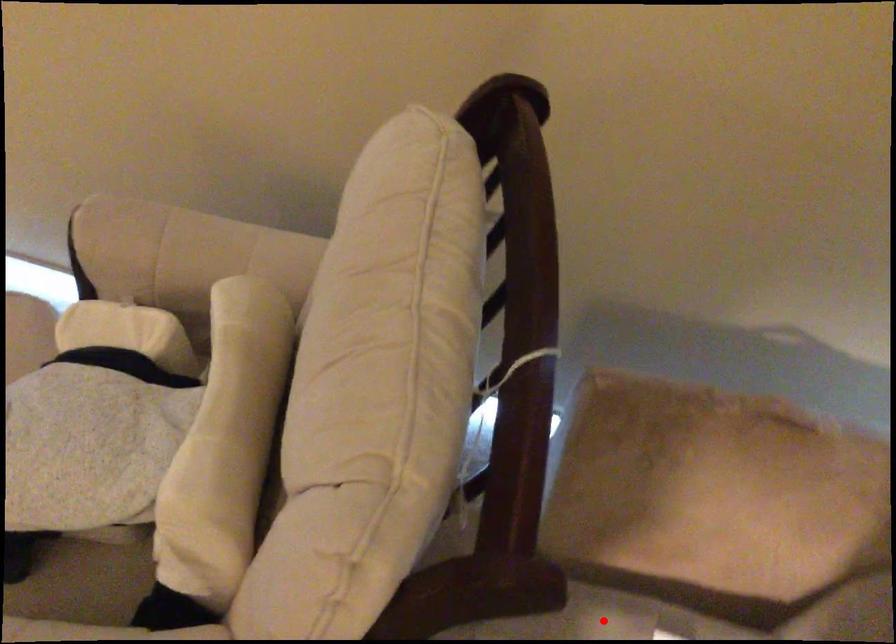
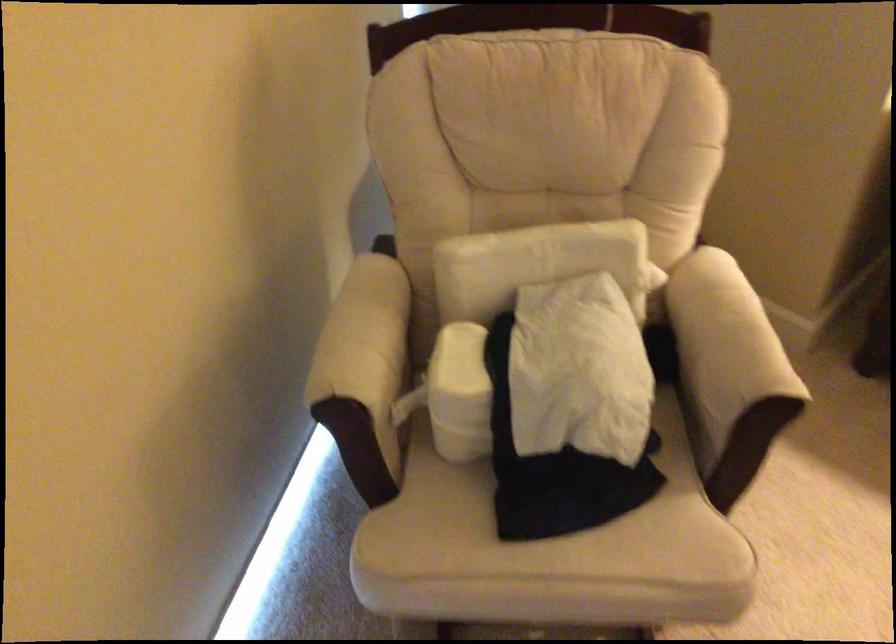
Question: I am providing you with two images of the same scene from different viewpoints. A red point is marked on the first image. Is the red point's position out of view in image 2?

Choices:
 (A) Yes
 (B) No

Answer: (A)